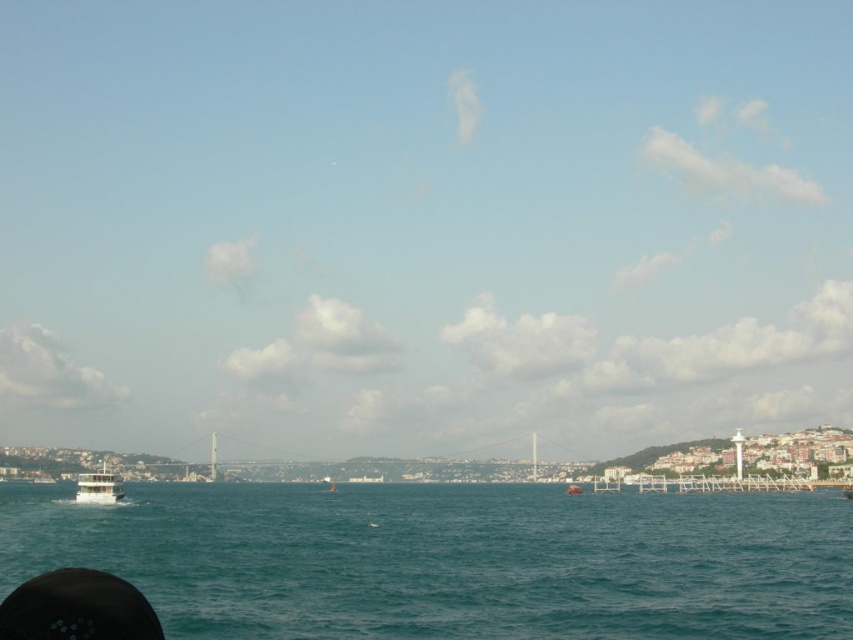
You are standing at the viewpoint of the image and see two points marked in the scene. Which point, point (115, 499) or point (569, 484), is closer to you?

Point (115, 499) is closer to the viewer than point (569, 484).